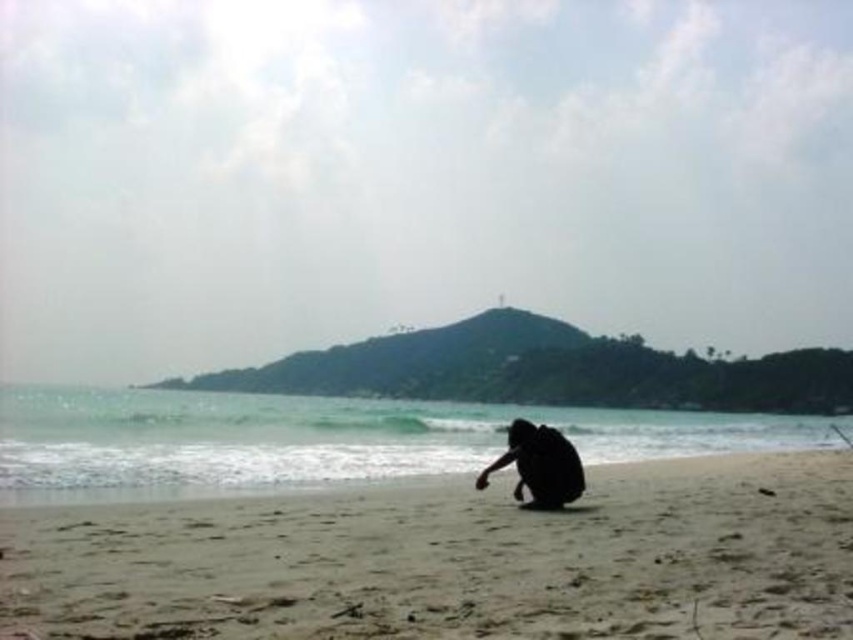
You are standing on the sandy beach at lower center and want to reach the black matte person at center. In which direction should you walk?

The sandy beach at lower center is to the right of the black matte person at center, so you should walk to the left to reach them.

You are standing on the sandy beach at lower center and want to approach the black matte person at center. Which direction should you move to reach them?

The sandy beach at lower center is positioned under the black matte person at center, so you should move upward to reach them.